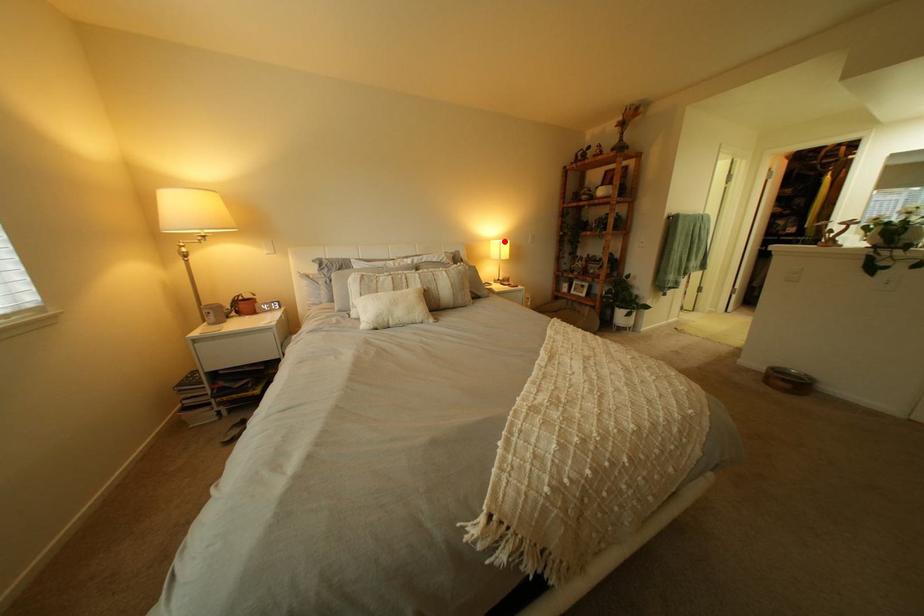
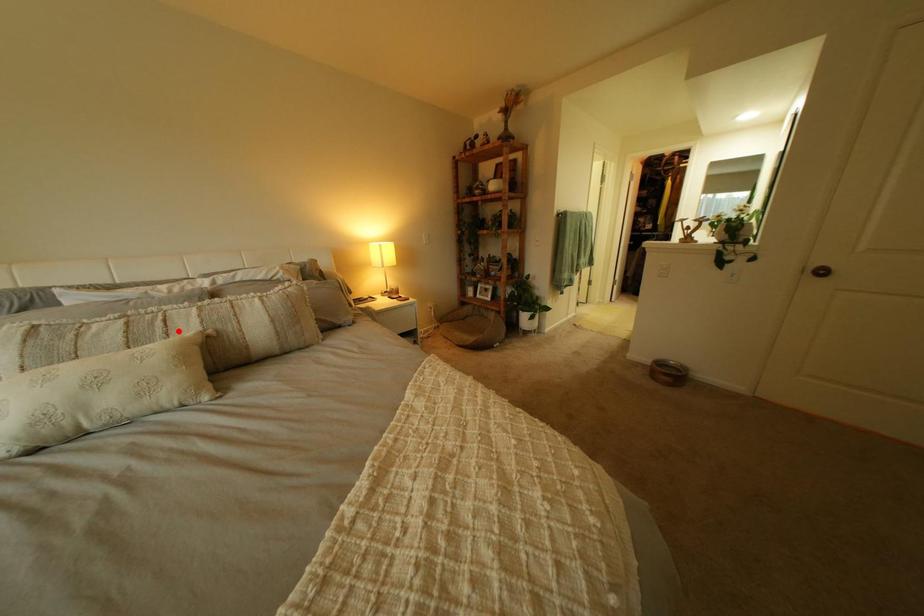
I am providing you with two images of the same scene from different viewpoints. A red point is marked on the first image and another point is marked on the second image. Is the marked point in image1 the same physical position as the marked point in image2?

No